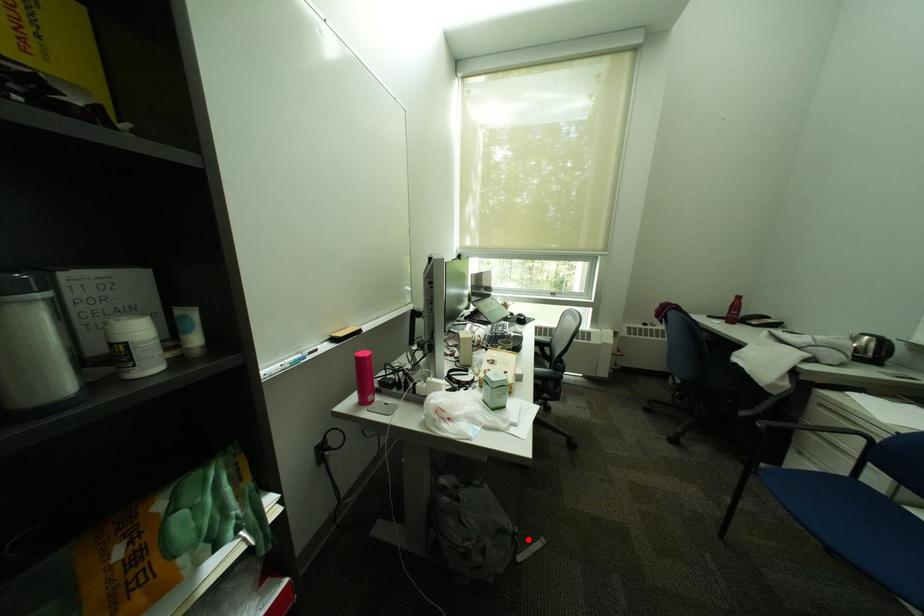
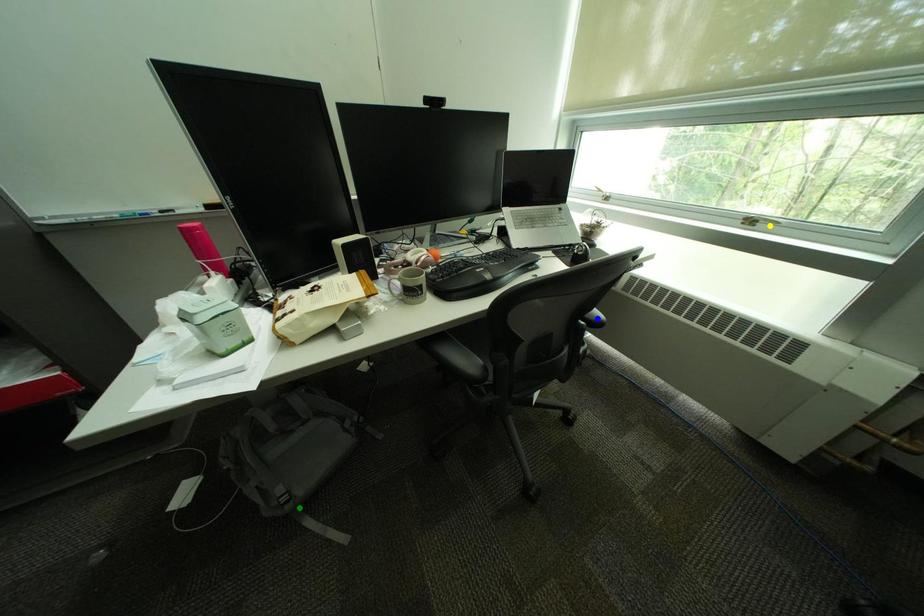
Question: I am providing you with two images of the same scene from different viewpoints. A red point is marked on the first image. You are given multiple points on the second image. In image 2, which mark is for the same physical point as the one in image 1?

Choices:
 (A) yellow point
 (B) green point
 (C) blue point

Answer: (B)